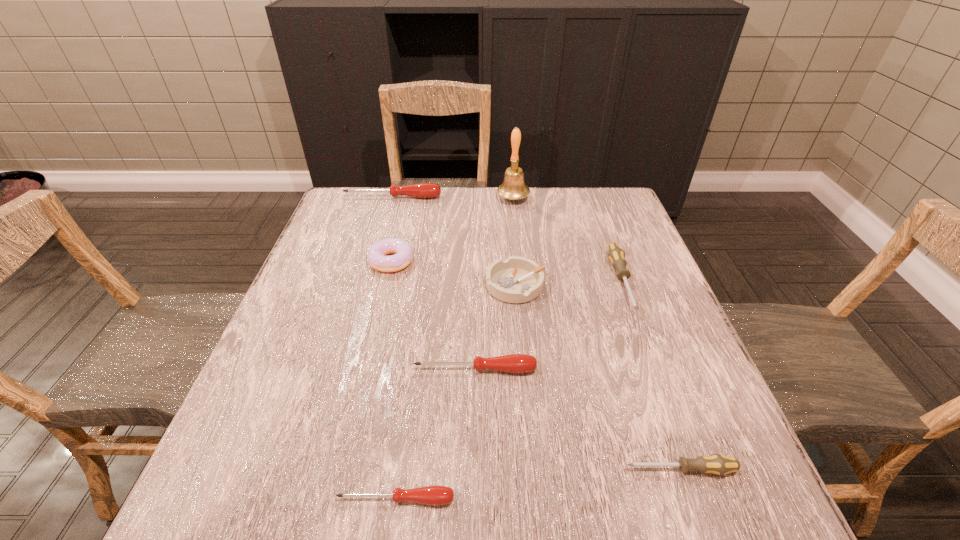
Where is `free space located 0.340m at the tip of the second nearest object`? The height and width of the screenshot is (540, 960). free space located 0.340m at the tip of the second nearest object is located at coordinates (415, 469).

Where is `free spot located 0.110m at the tip of the second nearest object`? free spot located 0.110m at the tip of the second nearest object is located at coordinates (557, 469).

The image size is (960, 540). What are the coordinates of `blank space located on the back of the nearest screwdriver` in the screenshot? It's located at (422, 309).

The width and height of the screenshot is (960, 540). Find the location of `bell that is at the far edge`. bell that is at the far edge is located at coordinates (513, 187).

This screenshot has width=960, height=540. Identify the location of screwdriver that is at the far edge. (422, 190).

Where is `screwdriver that is at the left edge`? The image size is (960, 540). screwdriver that is at the left edge is located at coordinates tap(422, 190).

I want to click on doughnut that is at the left edge, so click(403, 254).

At what (x,y) coordinates should I click in order to perform the action: click on object present at the far left corner. Please return your answer as a coordinate pair (x, y). Looking at the image, I should click on (422, 190).

This screenshot has height=540, width=960. I want to click on object that is positioned at the near right corner, so click(717, 464).

In the image, there is a desktop. Where is `vacant space at the far edge`? This screenshot has height=540, width=960. vacant space at the far edge is located at coordinates (497, 196).